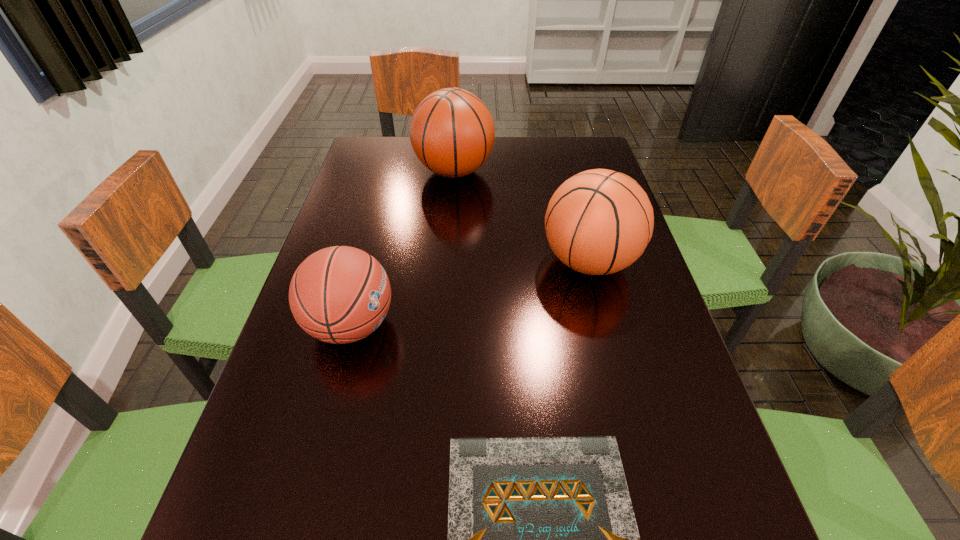
Where is `the farthest basketball`? the farthest basketball is located at coordinates (452, 132).

Where is `the rightmost basketball`? Image resolution: width=960 pixels, height=540 pixels. the rightmost basketball is located at coordinates (600, 221).

Identify the location of the second shortest object. (340, 294).

At what (x,y) coordinates should I click in order to perform the action: click on vacant position located 0.210m on the right of the farthest basketball. Please return your answer as a coordinate pair (x, y). Looking at the image, I should click on click(x=565, y=172).

Identify the location of vacant space positioned 0.230m on the left of the rightmost basketball. The height and width of the screenshot is (540, 960). (441, 261).

This screenshot has height=540, width=960. Find the location of `free space located on the logo side of the second shortest object`. free space located on the logo side of the second shortest object is located at coordinates (565, 325).

Find the location of a particular element. object that is at the far edge is located at coordinates (452, 132).

Where is `object positioned at the left edge`? This screenshot has width=960, height=540. object positioned at the left edge is located at coordinates (340, 294).

Locate an element on the screen. object that is at the right edge is located at coordinates (600, 221).

In the image, there is a desktop. Where is `vacant space at the left edge`? This screenshot has width=960, height=540. vacant space at the left edge is located at coordinates (389, 240).